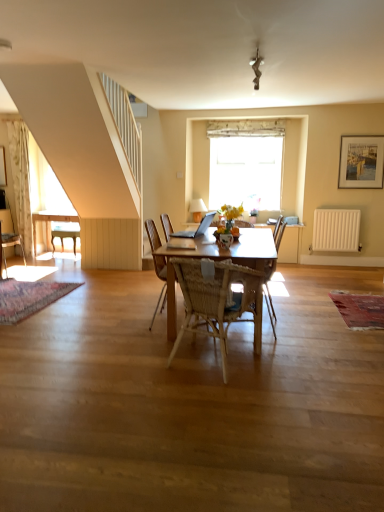
What are the coordinates of `free spot above wooden framed painting at upper right (from a real-world perspective)` in the screenshot? It's located at (364, 130).